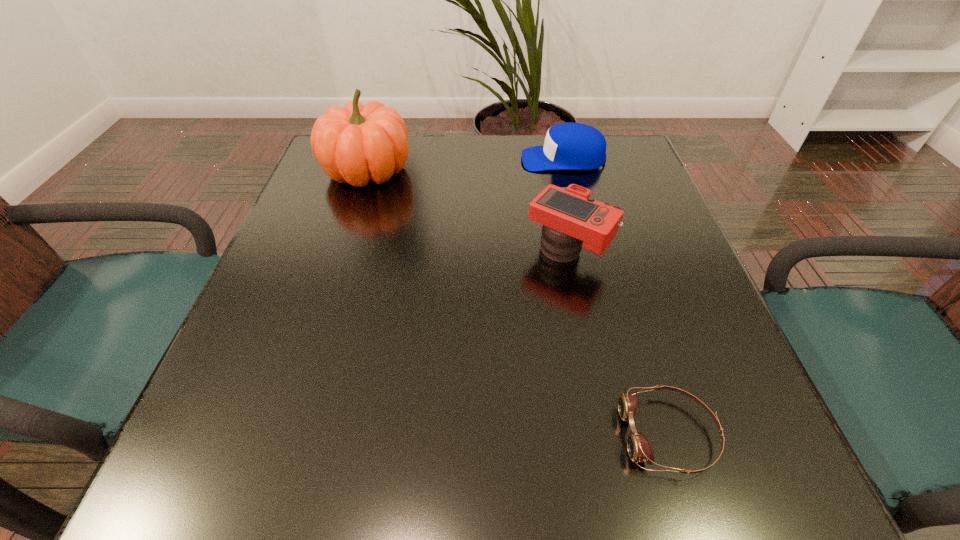
Identify the location of free space located 0.210m on the front-facing side of the baseball cap. (438, 159).

What are the coordinates of `blank area located 0.070m on the front-facing side of the baseball cap` in the screenshot? It's located at (493, 159).

The height and width of the screenshot is (540, 960). What are the coordinates of `vacant space situated through the lenses of the goggles` in the screenshot? It's located at (572, 434).

Locate an element on the screen. The height and width of the screenshot is (540, 960). vacant space located 0.090m through the lenses of the goggles is located at coordinates (558, 434).

This screenshot has width=960, height=540. I want to click on blank space located through the lenses of the goggles, so click(348, 434).

The image size is (960, 540). What are the coordinates of `pumpkin situated at the far edge` in the screenshot? It's located at (359, 143).

Identify the location of baseball cap present at the far edge. (568, 146).

I want to click on object situated at the near edge, so click(x=639, y=448).

The image size is (960, 540). In order to click on object that is at the left edge in this screenshot , I will do `click(359, 143)`.

You are a GUI agent. You are given a task and a screenshot of the screen. Output one action in this format:
    pyautogui.click(x=<x>, y=<y>)
    Task: Click on the camera positioned at the right edge
    
    Given the screenshot: What is the action you would take?
    pyautogui.click(x=572, y=219)